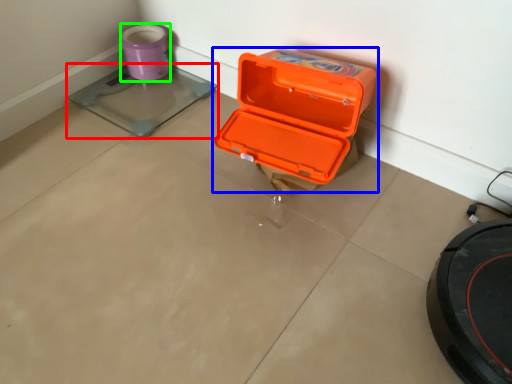
Question: Based on their relative distances, which object is nearer to weight scale (highlighted by a red box)? Choose from box (highlighted by a blue box) and appliance (highlighted by a green box).

Choices:
 (A) box
 (B) appliance

Answer: (B)